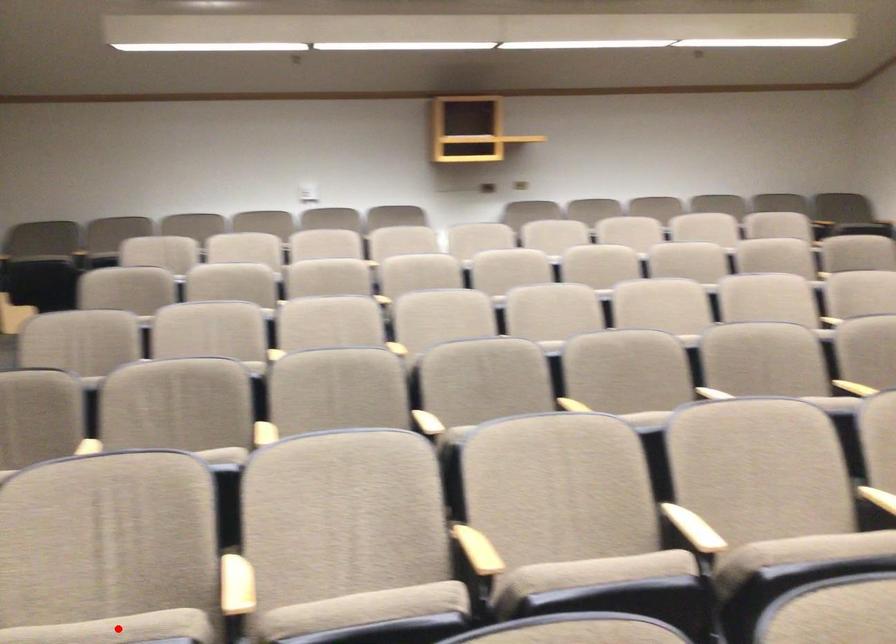
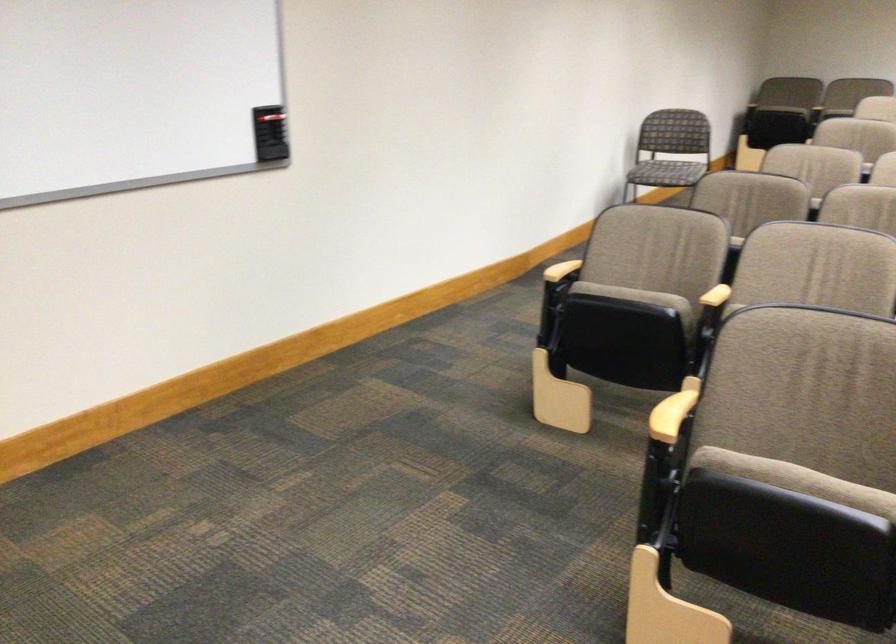
Question: I am providing you with two images of the same scene from different viewpoints. A red point is marked on the first image. Is the red point's position out of view in image 2?

Choices:
 (A) Yes
 (B) No

Answer: (A)